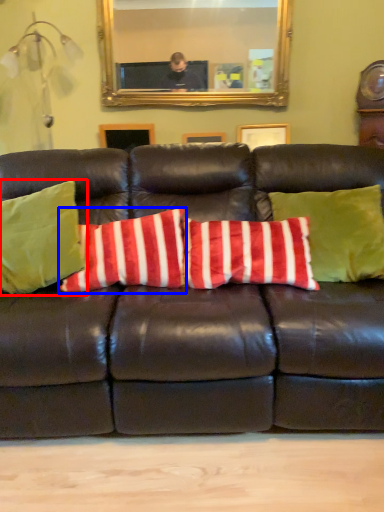
Question: Which object is further to the camera taking this photo, pillow (highlighted by a red box) or pillow (highlighted by a blue box)?

Choices:
 (A) pillow
 (B) pillow

Answer: (B)